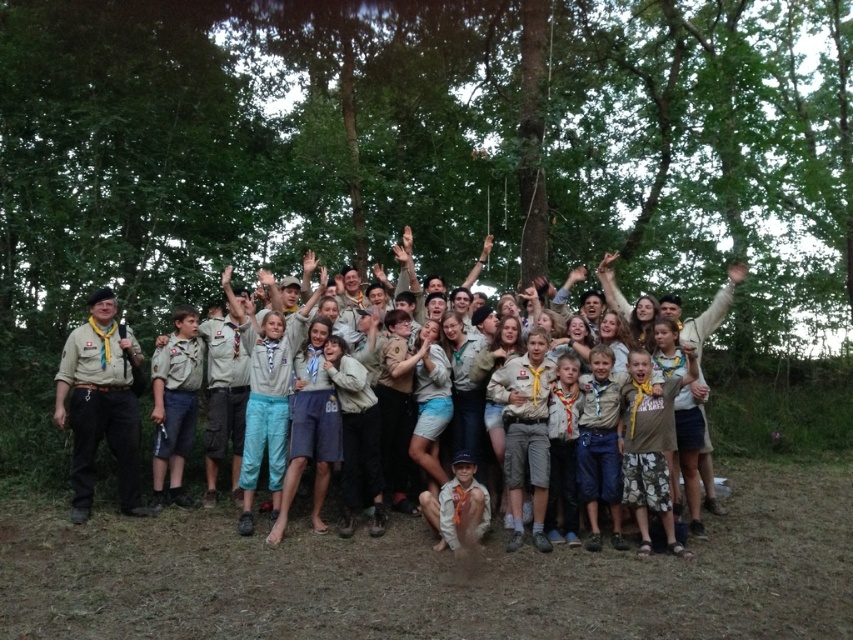
You are a scout leader trying to locate your team members. You see the brown uniform at center and the matte khaki beret at left. Which one is closer to you?

The brown uniform at center is closer to you because the matte khaki beret at left is behind it.

Based on the coordinates provided, which object is located at point (427,150) in the scene?

The green leafy tree at center is located at point (427,150).

You are a scout leader assessing the scene. You notice the green leafy tree at center and the matte khaki beret at left. Which object is bigger in size?

The green leafy tree at center is larger in size compared to the matte khaki beret at left according to the description.